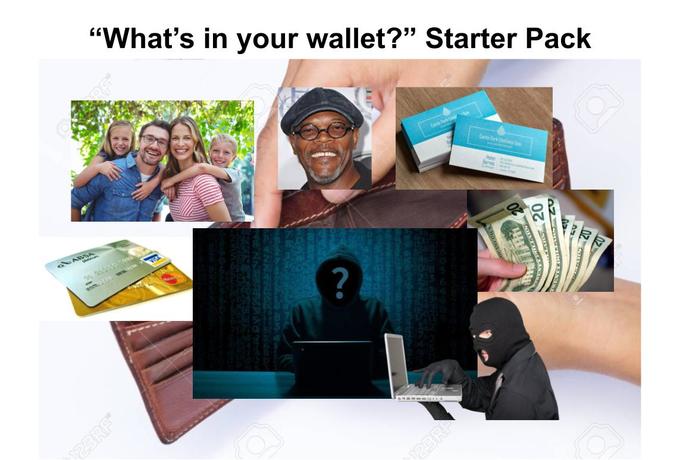
This screenshot has height=460, width=680. What are the coordinates of `wooden table top` in the screenshot? It's located at (530, 105).